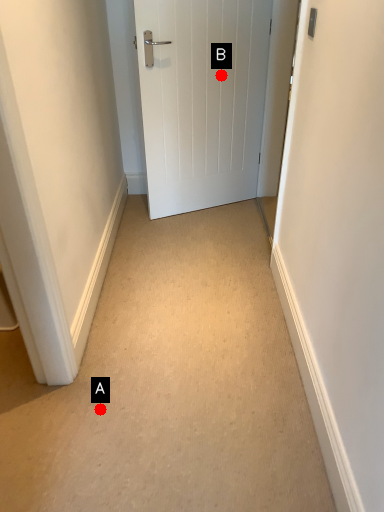
Question: Two points are circled on the image, labeled by A and B beside each circle. Which point appears closest to the camera in this image?

Choices:
 (A) A is closer
 (B) B is closer

Answer: (A)